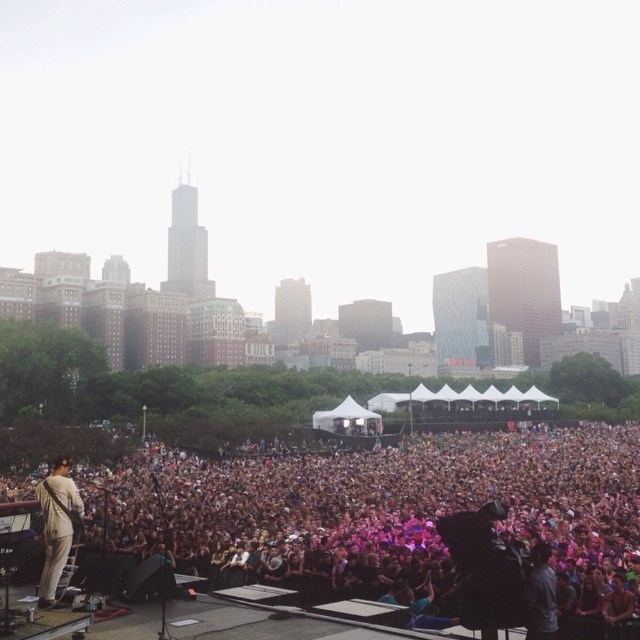
You are a photographer at the concert and want to capture a photo that includes both the pink fabric crowd at center and the light beige suit at center. Based on their positions, which object should you position on the right side of your camera frame?

The pink fabric crowd at center is to the right of the light beige suit at center, so you should position the pink fabric crowd at center on the right side of your camera frame.

Based on the photo, you are a photographer at the concert and want to capture a photo that includes both the pink fabric crowd at center and the light beige suit at center. Which object will appear larger in the photo?

The pink fabric crowd at center will appear larger in the photo because it is bigger than the light beige suit at center according to the description.